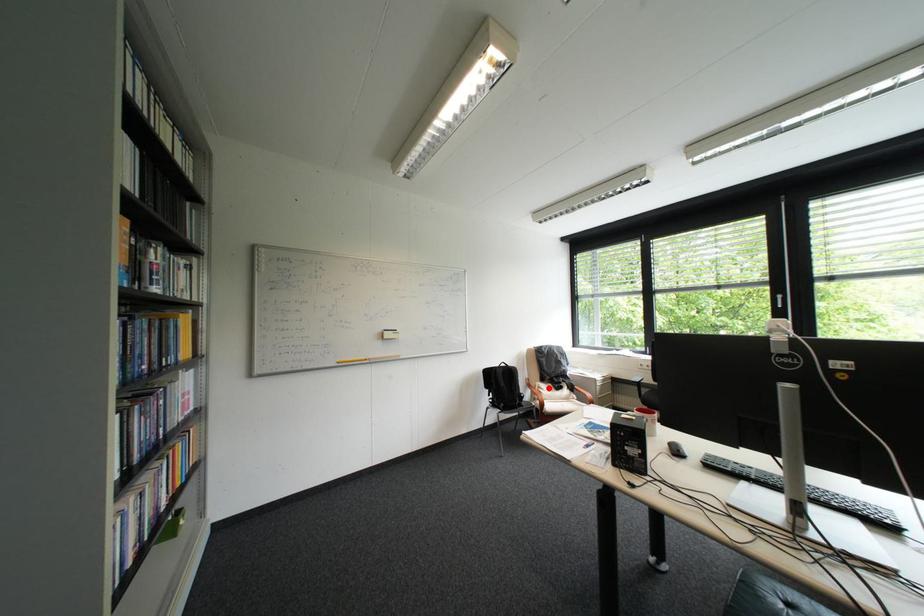
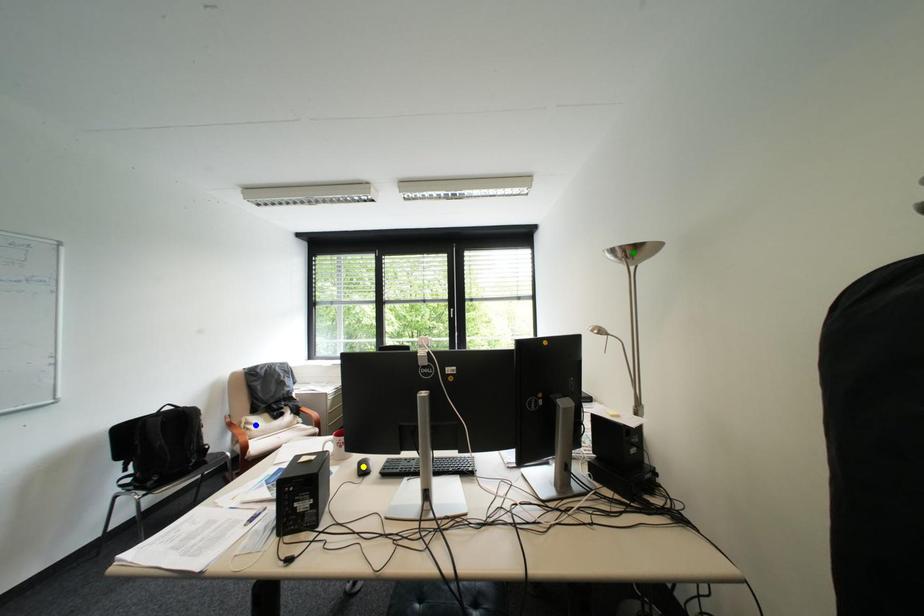
Question: I am providing you with two images of the same scene from different viewpoints. A red point is marked on the first image. You are given multiple points on the second image. In image 2, which mark is for the same physical point as the one in image 1?

Choices:
 (A) yellow point
 (B) green point
 (C) blue point

Answer: (C)